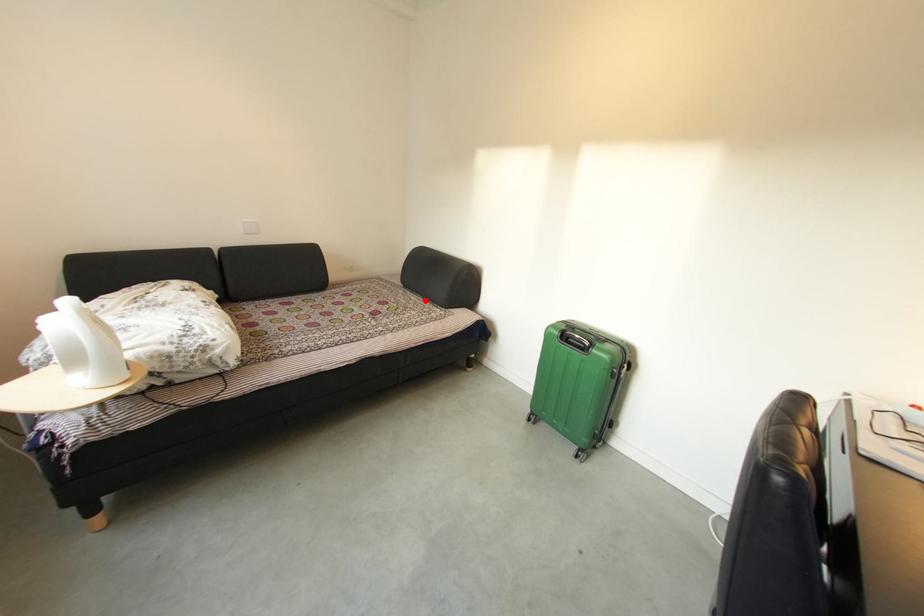
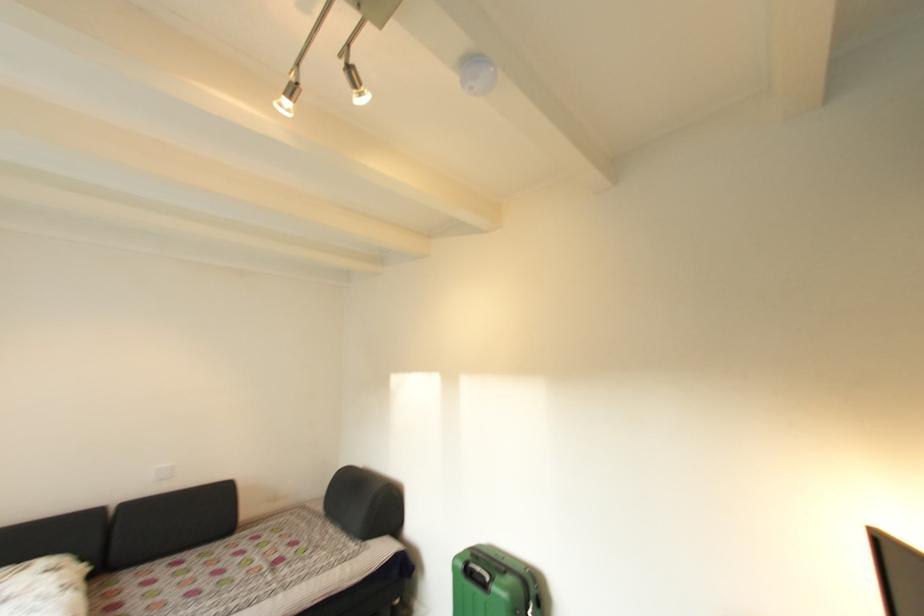
Find the pixel in the second image that matches the highlighted location in the first image.

(344, 533)